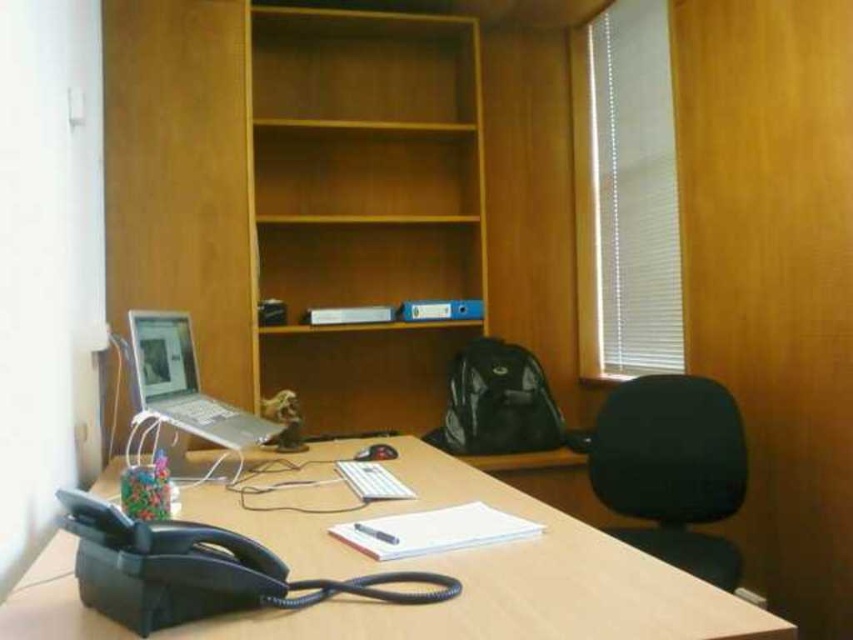
Question: Based on their relative distances, which object is nearer to the silver metallic laptop at left?

Choices:
 (A) wooden bookshelf at center
 (B) black fabric swivel chair at right

Answer: (A)

Question: Considering the relative positions of wooden bookshelf at center and silver metallic laptop at left in the image provided, where is wooden bookshelf at center located with respect to silver metallic laptop at left?

Choices:
 (A) left
 (B) right

Answer: (B)

Question: Does wooden bookshelf at center have a larger size compared to light brown wood computer desk at lower center?

Choices:
 (A) no
 (B) yes

Answer: (B)

Question: Based on their relative distances, which object is farther from the wooden bookshelf at center?

Choices:
 (A) silver metallic laptop at left
 (B) light brown wood computer desk at lower center
 (C) black fabric swivel chair at right

Answer: (C)

Question: Is black fabric swivel chair at right wider than silver metallic laptop at left?

Choices:
 (A) yes
 (B) no

Answer: (A)

Question: Which point is closer to the camera?

Choices:
 (A) light brown wood computer desk at lower center
 (B) silver metallic laptop at left
 (C) wooden bookshelf at center
 (D) black fabric swivel chair at right

Answer: (A)